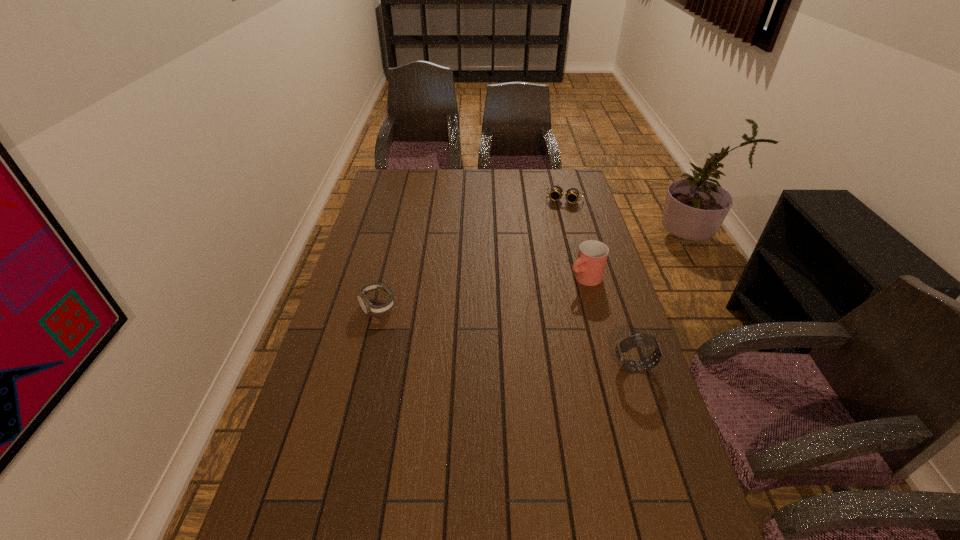
This screenshot has height=540, width=960. I want to click on free spot on the desktop that is between the leftmost object and the right watch and is positioned through the lenses of the farthest object, so click(530, 342).

Identify the location of free space on the desktop that is between the leftmost object and the taller watch and is positioned on the side of the third nearest object with the handle. This screenshot has width=960, height=540. (492, 333).